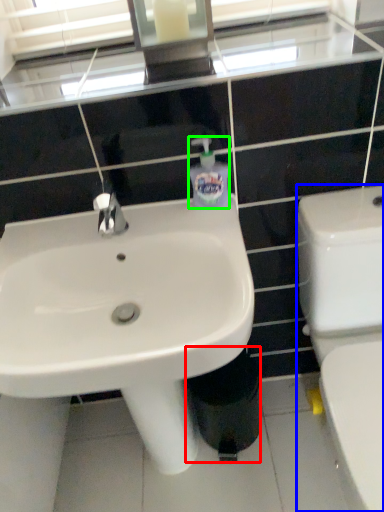
Question: Considering the real-world distances, which object is closest to trash bin/can (highlighted by a red box)? toilet (highlighted by a blue box) or toiletries (highlighted by a green box).

Choices:
 (A) toilet
 (B) toiletries

Answer: (A)